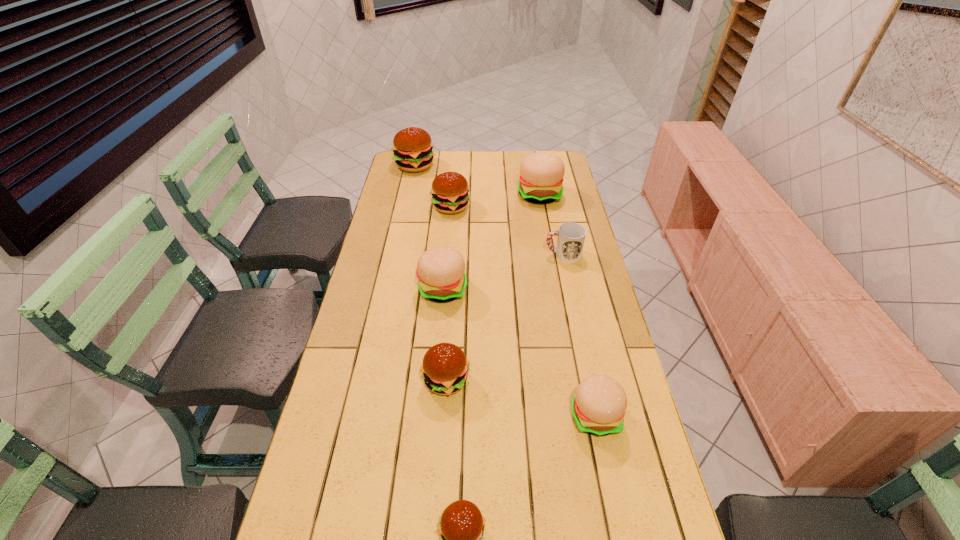
Find the location of a particular element. the sixth closest object to the leftmost beige hamburger is located at coordinates (461, 527).

Identify which hamburger is located as the fourth nearest to the red cup. Please provide its 2D coordinates. Your answer should be formatted as a tuple, i.e. [(x, y)], where the tuple contains the x and y coordinates of a point satisfying the conditions above.

[(445, 368)]

Choose which hamburger is the nearest neighbor to the second nearest brown hamburger. Please provide its 2D coordinates. Your answer should be formatted as a tuple, i.e. [(x, y)], where the tuple contains the x and y coordinates of a point satisfying the conditions above.

[(441, 270)]

The image size is (960, 540). I want to click on the second closest brown hamburger to the nearest object, so click(449, 191).

At what (x,y) coordinates should I click in order to perform the action: click on the closest brown hamburger relative to the nearest brown hamburger. Please return your answer as a coordinate pair (x, y). The width and height of the screenshot is (960, 540). Looking at the image, I should click on (445, 368).

Choose which beige hamburger is the second nearest neighbor to the farthest beige hamburger. Please provide its 2D coordinates. Your answer should be formatted as a tuple, i.e. [(x, y)], where the tuple contains the x and y coordinates of a point satisfying the conditions above.

[(598, 406)]

Select which beige hamburger appears as the closest to the shortest hamburger. Please provide its 2D coordinates. Your answer should be formatted as a tuple, i.e. [(x, y)], where the tuple contains the x and y coordinates of a point satisfying the conditions above.

[(598, 406)]

At what (x,y) coordinates should I click in order to perform the action: click on free region that satisfies the following two spatial constraints: 1. on the front side of the smallest beige hamburger; 2. on the right side of the farthest beige hamburger. Please return your answer as a coordinate pair (x, y). The width and height of the screenshot is (960, 540). Looking at the image, I should click on (579, 416).